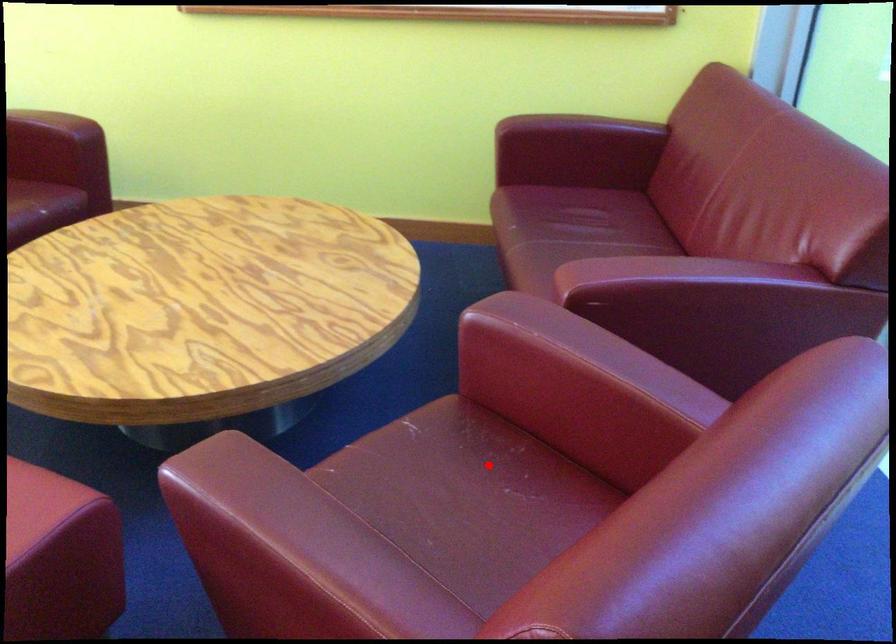
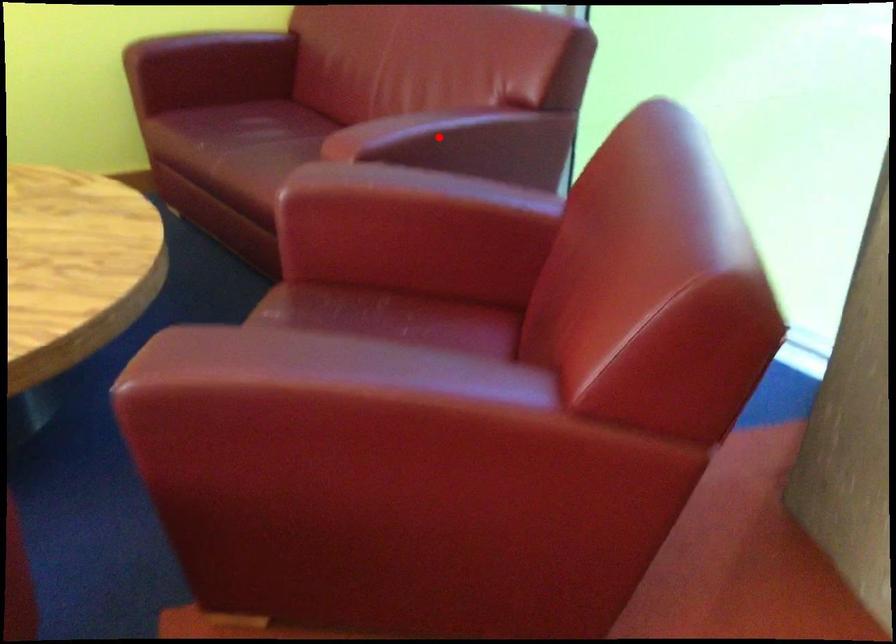
I am providing you with two images of the same scene from different viewpoints. A red point is marked on the first image and another point is marked on the second image. Is the marked point in image1 the same physical position as the marked point in image2?

No